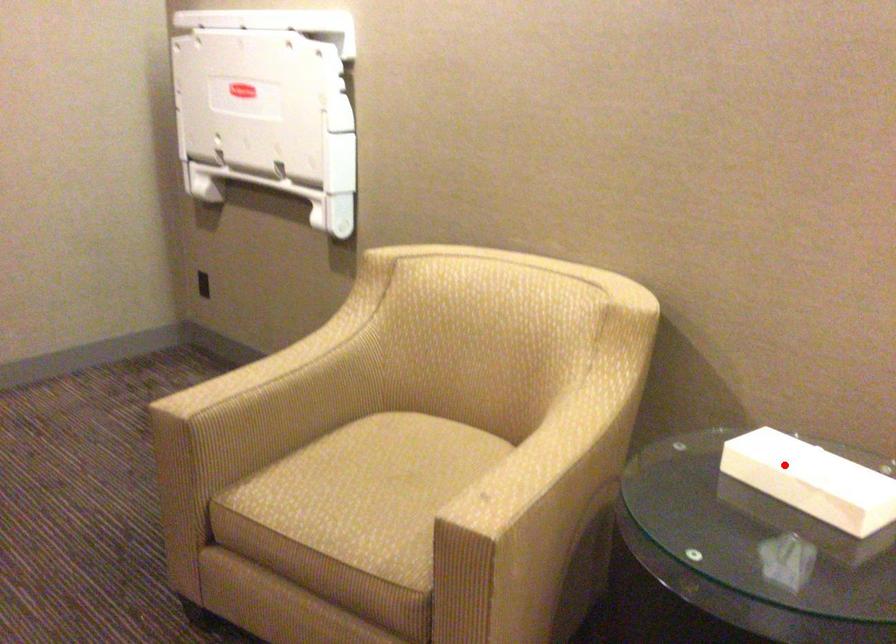
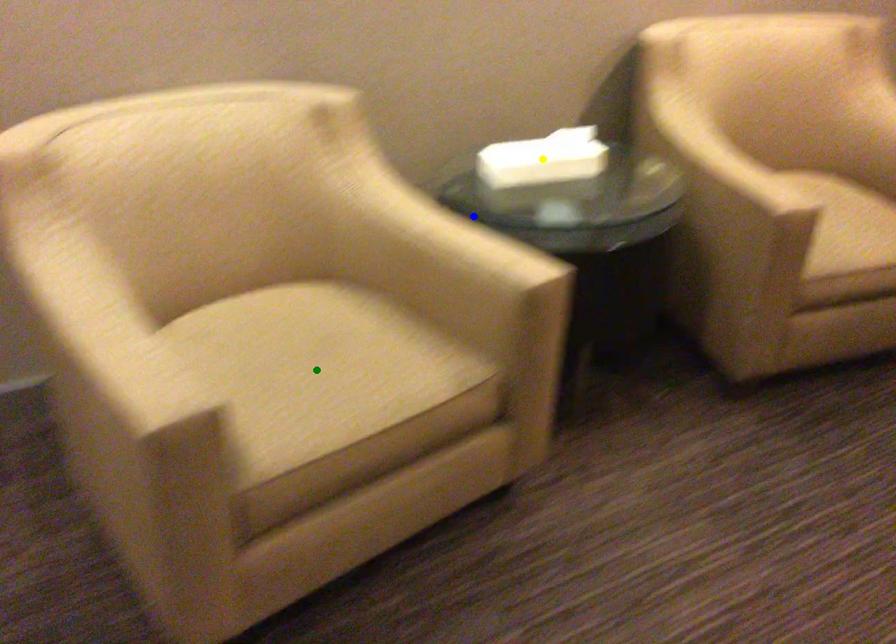
Question: I am providing you with two images of the same scene from different viewpoints. A red point is marked on the first image. You are given multiple points on the second image. Can you choose the point in image 2 that corresponds to the point in image 1?

Choices:
 (A) yellow point
 (B) green point
 (C) blue point

Answer: (A)